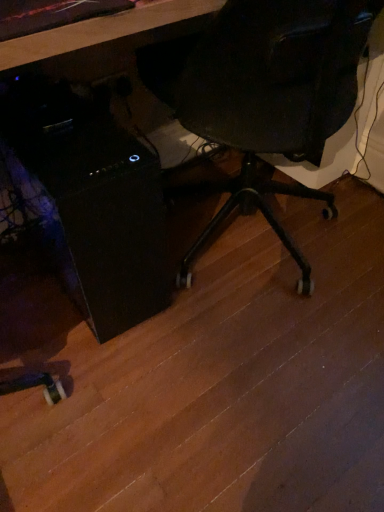
At what (x,y) coordinates should I click in order to perform the action: click on vacant space in front of black matte computer tower at lower left. Please return your answer as a coordinate pair (x, y). Image resolution: width=384 pixels, height=512 pixels. Looking at the image, I should click on (96, 382).